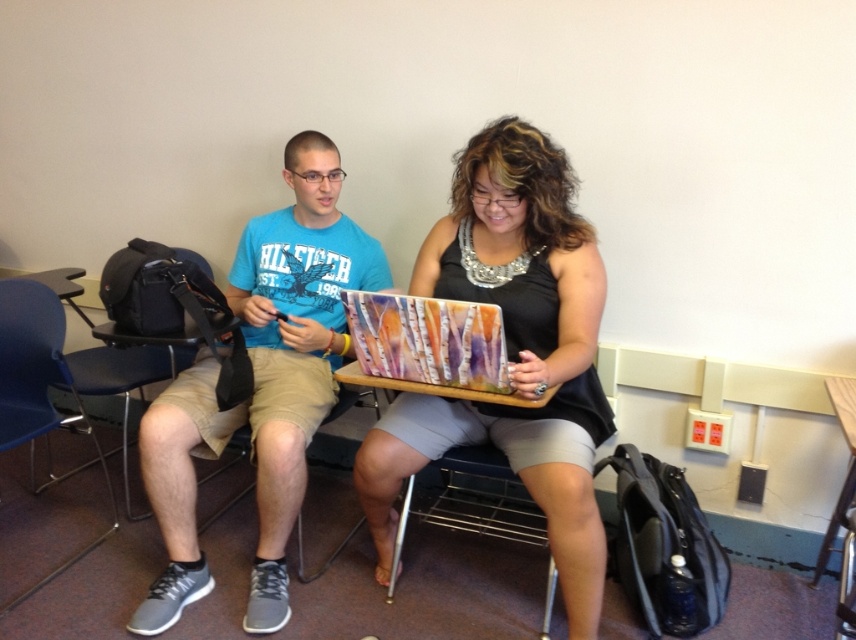
Question: Can you confirm if metallic silver laptop at center is positioned to the left of metallic silver chair at lower center?

Choices:
 (A) no
 (B) yes

Answer: (B)

Question: Is metallic silver laptop at center below blue plastic chair at lower left?

Choices:
 (A) yes
 (B) no

Answer: (B)

Question: Which object appears closest to the camera in this image?

Choices:
 (A) metallic silver chair at lower center
 (B) matte blue t-shirt at center

Answer: (A)

Question: Which of the following is the farthest from the observer?

Choices:
 (A) matte blue t-shirt at center
 (B) blue plastic chair at lower left
 (C) metallic silver laptop at center

Answer: (B)

Question: Based on their relative distances, which object is nearer to the blue plastic chair at lower left?

Choices:
 (A) matte blue t-shirt at center
 (B) metallic silver laptop at center

Answer: (A)

Question: Can you confirm if metallic silver laptop at center is smaller than metallic silver chair at lower center?

Choices:
 (A) yes
 (B) no

Answer: (B)